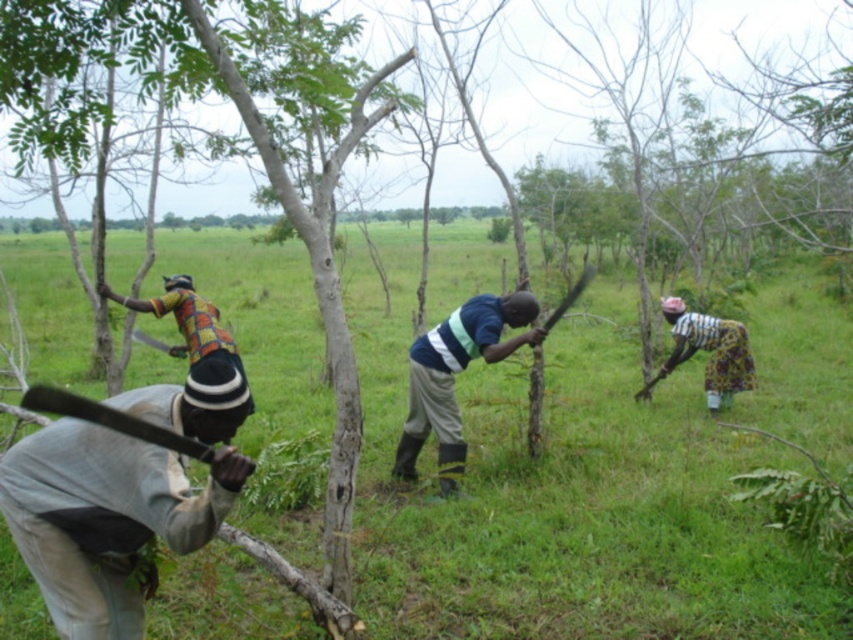
You are a farmer in the field and need to determine which object is taller between the brown wooden stick at center and the blue striped shirt at center. Which one is taller?

The brown wooden stick at center is taller than the blue striped shirt at center.

You are standing in the field and want to place a flag at the point closer to you. Which point should you choose between point (253, 404) and point (26, 390)?

Point (253, 404) is closer to the camera than point (26, 390), so you should choose point (253, 404) to place the flag.

You are a photographer trying to capture the scene. You have a camera with a 50mm lens. The multicolored fabric shirt at left and the black matte ax at lower left are both in the frame. Which object will appear larger in your photo?

The multicolored fabric shirt at left will appear larger in the photo because it has a greater height compared to the black matte ax at lower left.